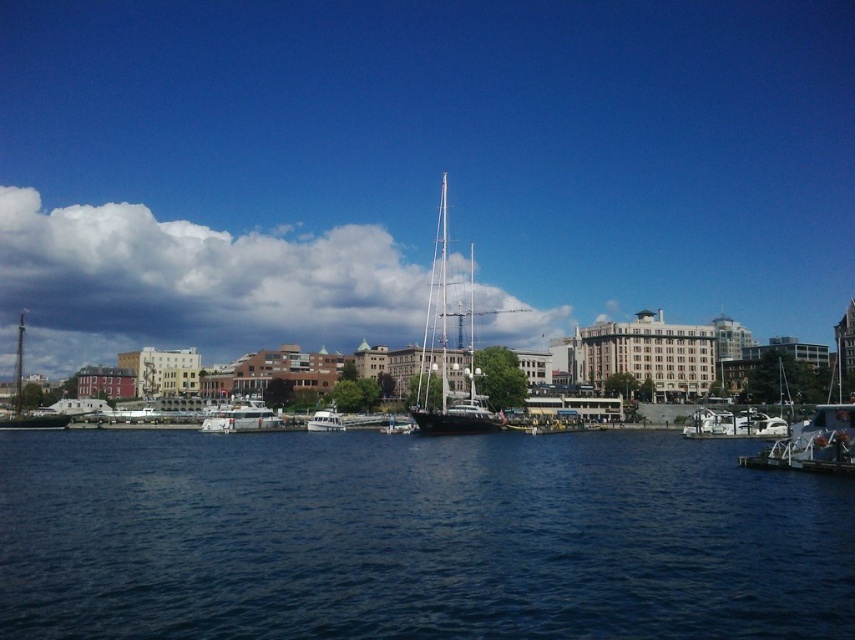
You are standing at the point marked as point (233, 397) and want to walk to the point marked as point (447, 516). Which direction should you move to get closer to your destination?

To move from point (233, 397) to point (447, 516), you should move towards the upper right direction since point (447, 516) is closer to the viewer than point (233, 397).

You are standing at the waterfront and want to determine which of the two points, point (x=81, y=269) or point (x=470, y=397), is closer to you. Based on the scene, which point is nearer?

Point (x=81, y=269) is closer to you because it is further to the viewer than point (x=470, y=397).

Consider the image. You are standing on the dock and looking at the dark blue water at center and the white matte boat at center. Which object is located below the other?

The dark blue water at center is positioned under the white matte boat at center, so the dark blue water at center is below the white matte boat at center.